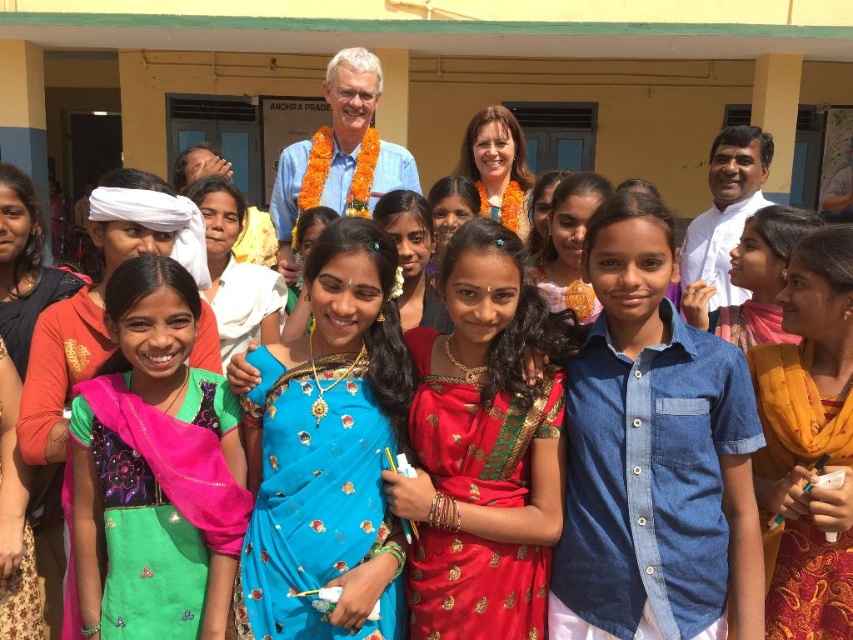
Consider the image. You are standing in front of the building and want to find the denim shirt at center. According to the coordinates provided, where should you look?

The denim shirt at center is located at point 0.709 on the x axis and 0.767 on the y axis.